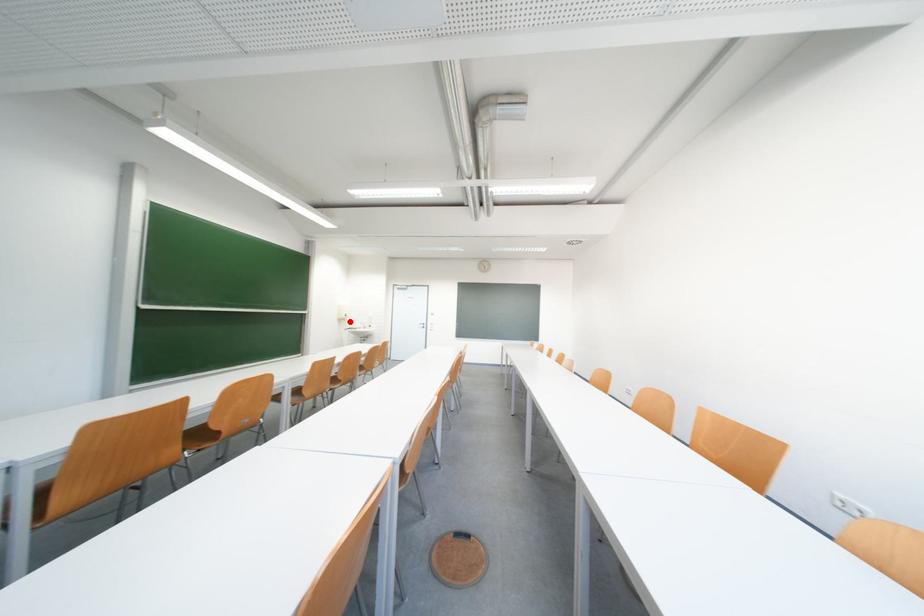
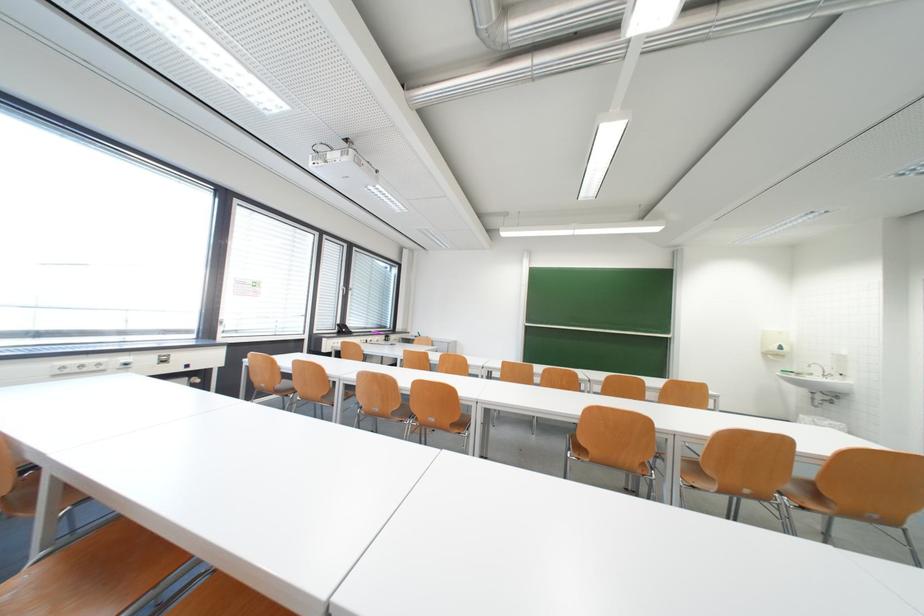
Question: I am providing you with two images of the same scene from different viewpoints. In image1, a red point is highlighted. Considering the same 3D point in image2, which of the following is correct?

Choices:
 (A) It is closer
 (B) It is farther

Answer: (B)